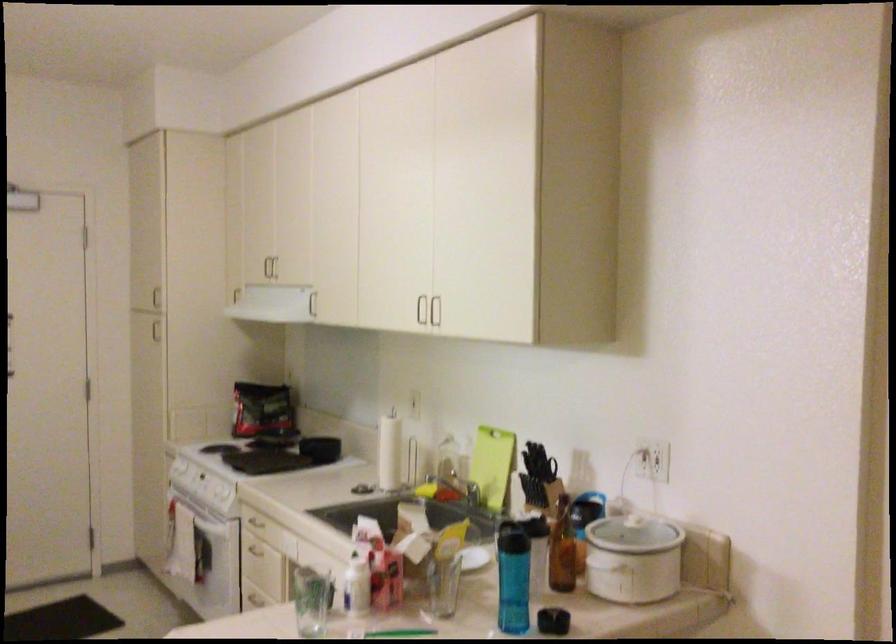
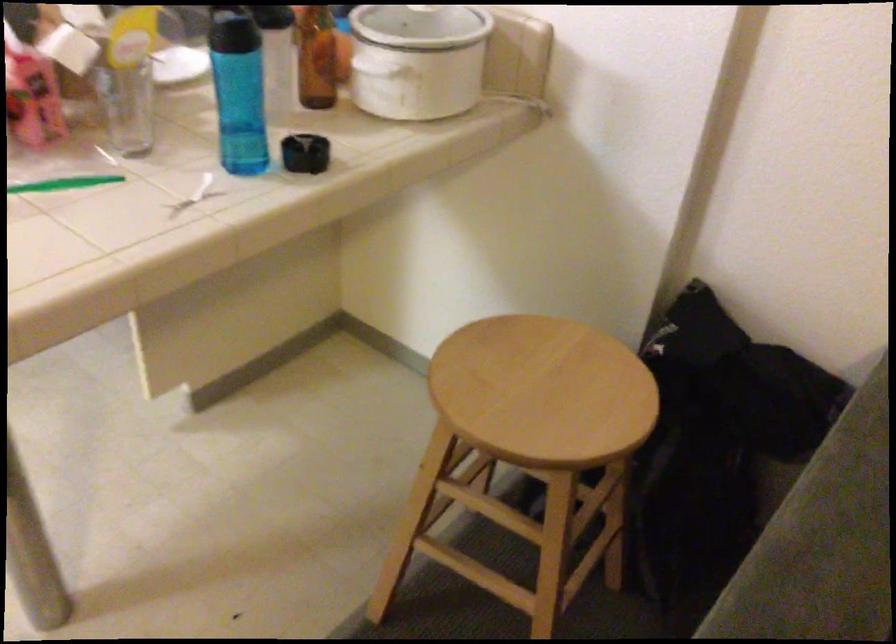
How did the camera likely rotate?

The rotation direction of the camera is right-down.